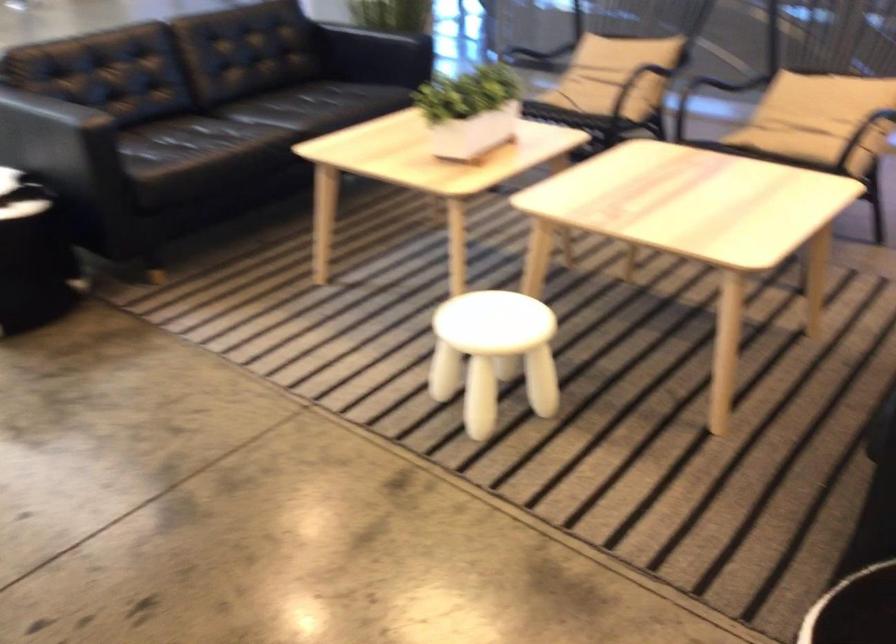
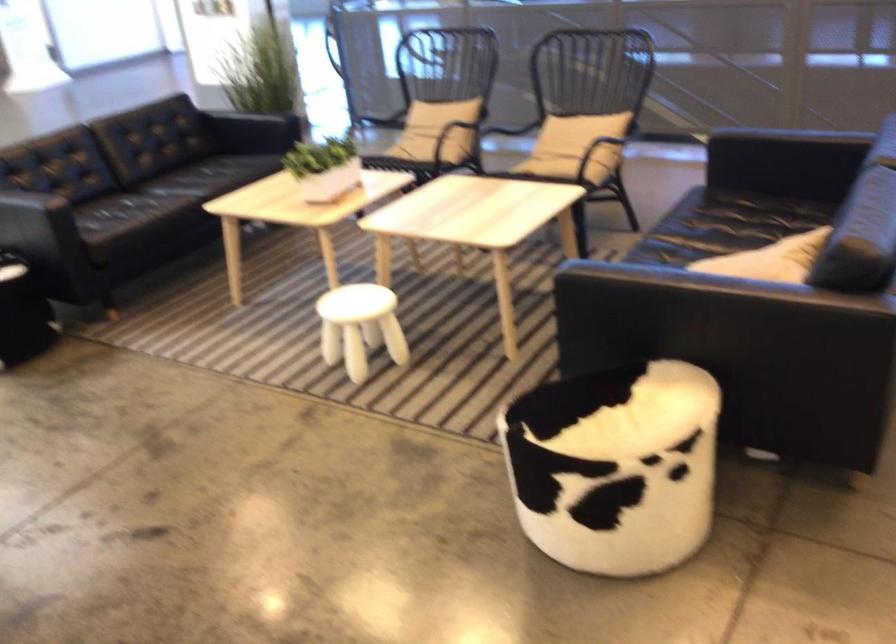
Find the pixel in the second image that matches [633,80] in the first image.

(440, 128)